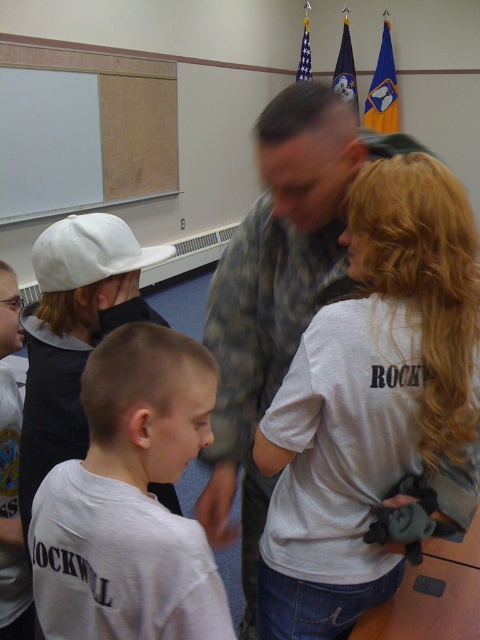
Looking at this image, is white cotton shirt at center to the right of white matte cap at left from the viewer's perspective?

Yes, white cotton shirt at center is to the right of white matte cap at left.

Find the location of a particular element. white cotton shirt at center is located at coordinates (370, 397).

Where is `white cotton shirt at center`? Image resolution: width=480 pixels, height=640 pixels. white cotton shirt at center is located at coordinates (370, 397).

Can you confirm if white cotton shirt at center is shorter than white matte shirt at center?

Incorrect, white cotton shirt at center's height does not fall short of white matte shirt at center's.

Which is behind, point (478, 369) or point (108, 497)?

Point (478, 369)

Locate an element on the screen. This screenshot has width=480, height=640. white cotton shirt at center is located at coordinates (370, 397).

Consider the image. Is white cotton shirt at center below camouflage uniform at center?

No.

Between white cotton shirt at center and camouflage uniform at center, which one has less height?

white cotton shirt at center is shorter.

Image resolution: width=480 pixels, height=640 pixels. Identify the location of white cotton shirt at center. (370, 397).

The height and width of the screenshot is (640, 480). Identify the location of white cotton shirt at center. (370, 397).